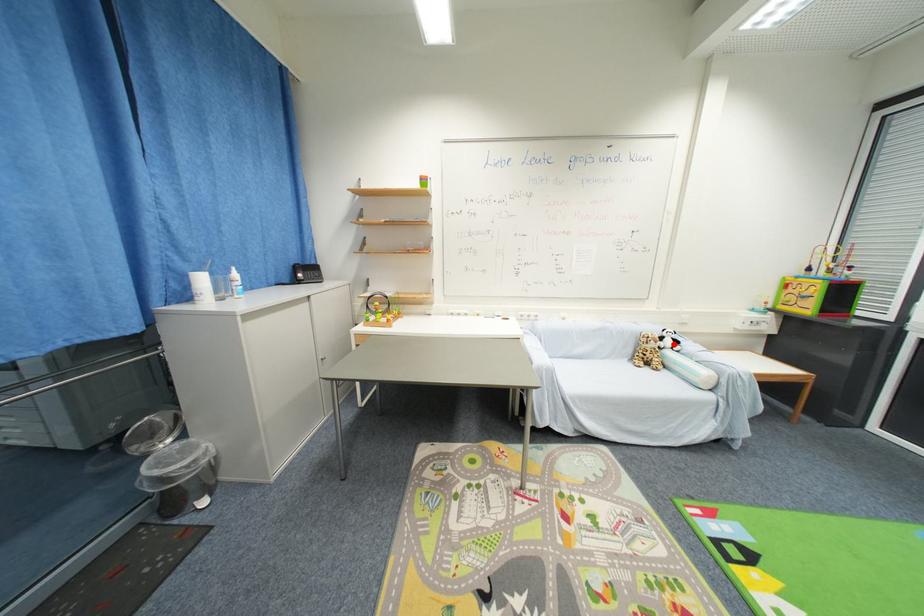
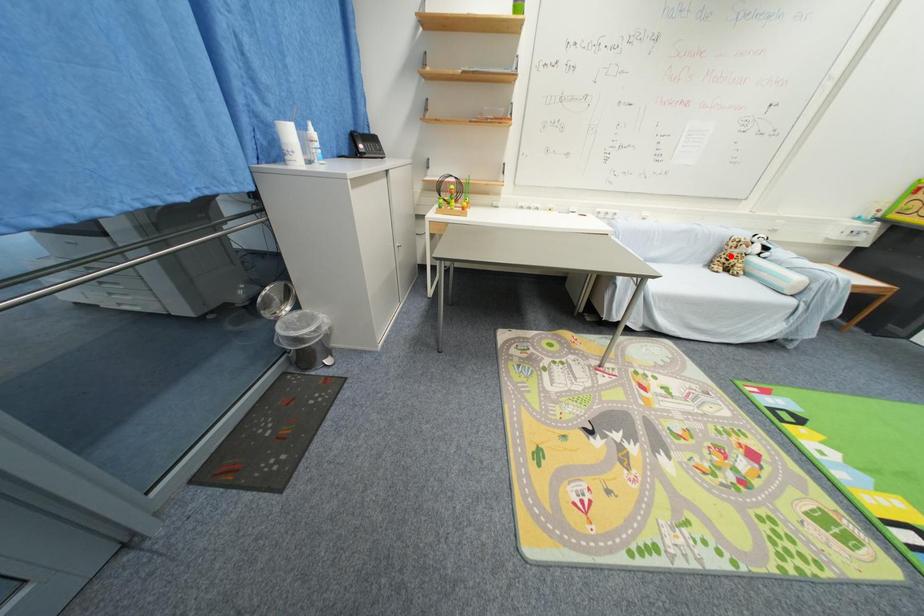
I am providing you with two images of the same scene from different viewpoints. A red point is marked on the first image and another point is marked on the second image. Is the marked point in image1 the same physical position as the marked point in image2?

No